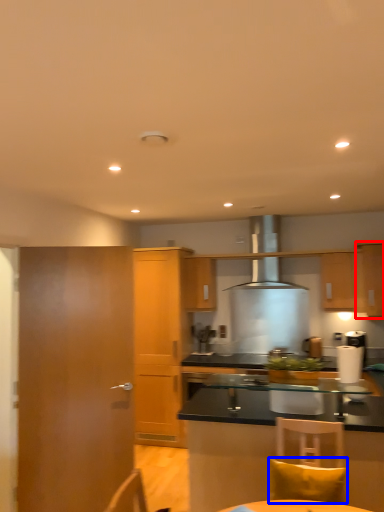
Question: Which object is closer to the camera taking this photo, cabinetry (highlighted by a red box) or pillow (highlighted by a blue box)?

Choices:
 (A) cabinetry
 (B) pillow

Answer: (B)